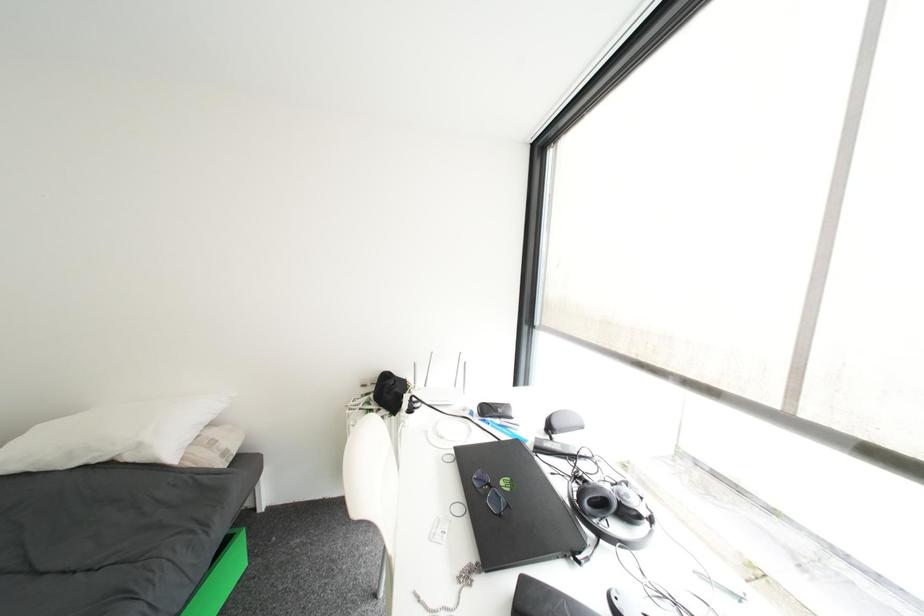
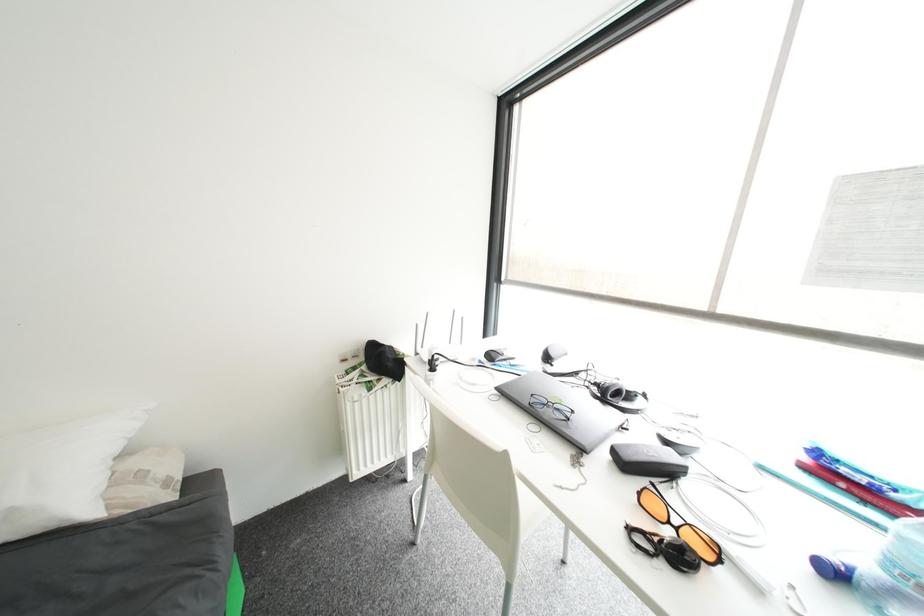
Question: The camera is either moving clockwise (left) or counter-clockwise (right) around the object. The first image is from the beginning of the video and the second image is from the end. Is the camera moving left or right when shooting the video?

Choices:
 (A) Left
 (B) Right

Answer: (A)